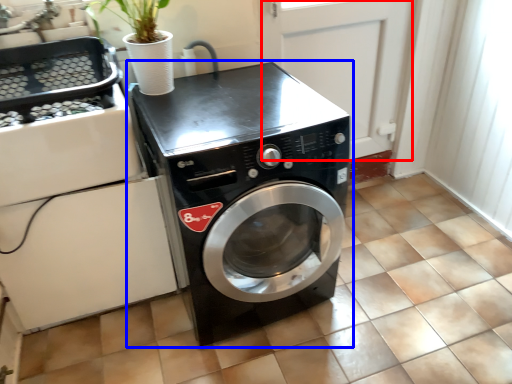
Question: Which point is further to the camera, screen door (highlighted by a red box) or washing machine (highlighted by a blue box)?

Choices:
 (A) screen door
 (B) washing machine

Answer: (A)